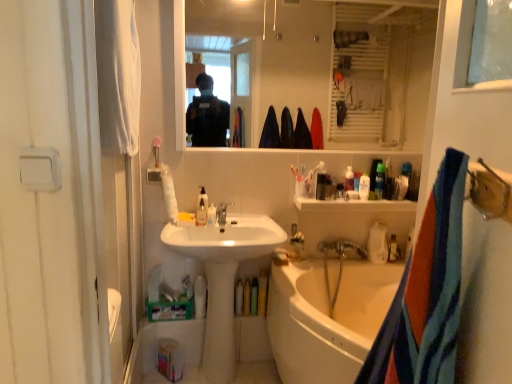
The height and width of the screenshot is (384, 512). In order to click on vacant space situated on the left part of translucent plastic soap dispenser at center, which is the 5th toiletry from right to left in this screenshot , I will do `click(179, 226)`.